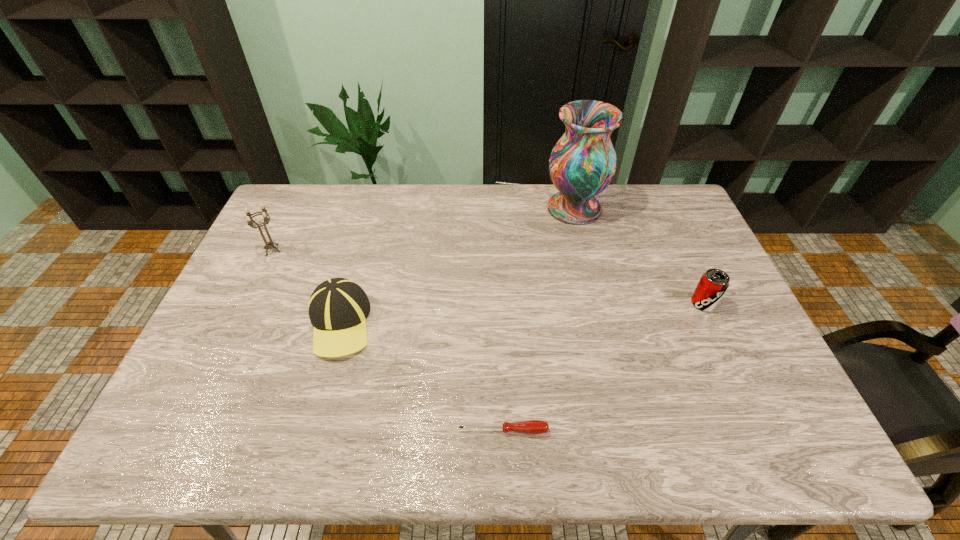
At what (x,y) coordinates should I click in order to perform the action: click on free space located 0.190m on the left of the soda can. Please return your answer as a coordinate pair (x, y). This screenshot has height=540, width=960. Looking at the image, I should click on (625, 303).

Where is `free space located with the brim of the baseball cap facing forward`? The height and width of the screenshot is (540, 960). free space located with the brim of the baseball cap facing forward is located at coordinates (302, 455).

Locate an element on the screen. This screenshot has height=540, width=960. vacant region located on the right of the nearest object is located at coordinates (702, 430).

Find the location of a particular element. object situated at the far edge is located at coordinates (582, 164).

You are a GUI agent. You are given a task and a screenshot of the screen. Output one action in this format:
    pyautogui.click(x=<x>, y=<y>)
    Task: Click on the object that is at the near edge
    This screenshot has width=960, height=540.
    Given the screenshot: What is the action you would take?
    pyautogui.click(x=535, y=427)

I want to click on object located at the left edge, so click(250, 221).

Where is `object located at the right edge`? The image size is (960, 540). object located at the right edge is located at coordinates (713, 284).

Locate an element on the screen. This screenshot has width=960, height=540. vacant space at the far edge of the desktop is located at coordinates (383, 215).

Where is `vacant space at the left edge of the desktop`? The height and width of the screenshot is (540, 960). vacant space at the left edge of the desktop is located at coordinates (260, 345).

I want to click on vacant space at the right edge, so click(x=680, y=260).